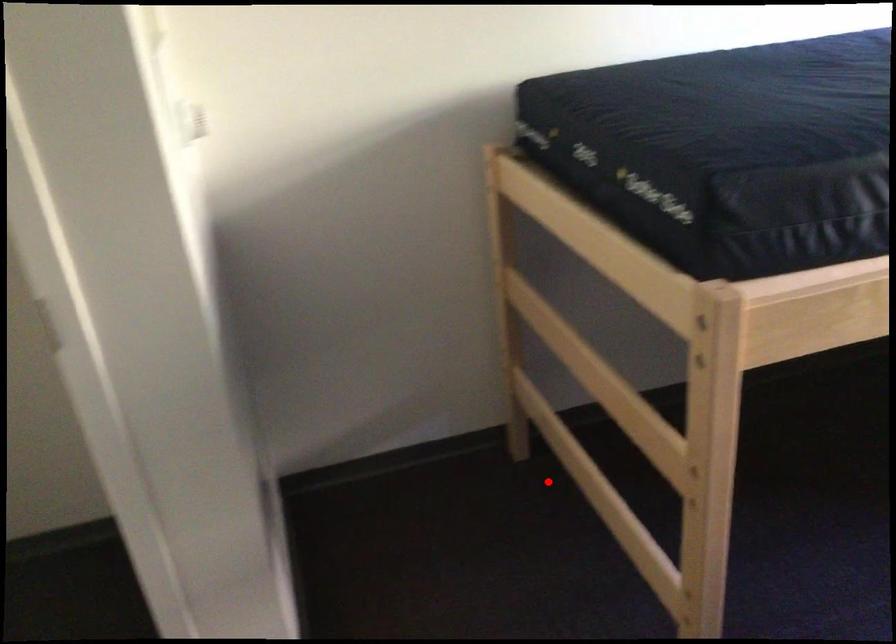
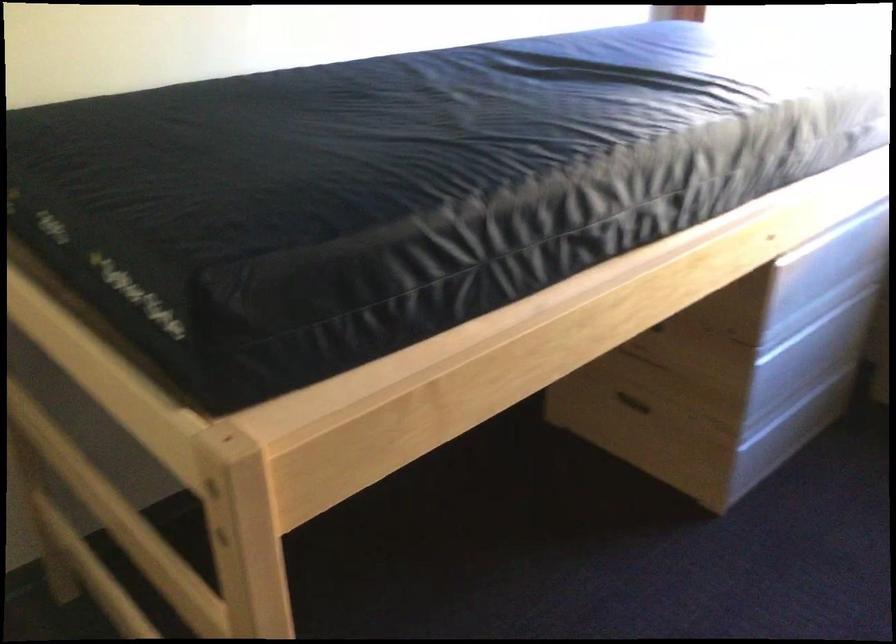
Question: I am providing you with two images of the same scene from different viewpoints. A red point is marked on the first image. Is the red point's position out of view in image 2?

Choices:
 (A) Yes
 (B) No

Answer: (B)